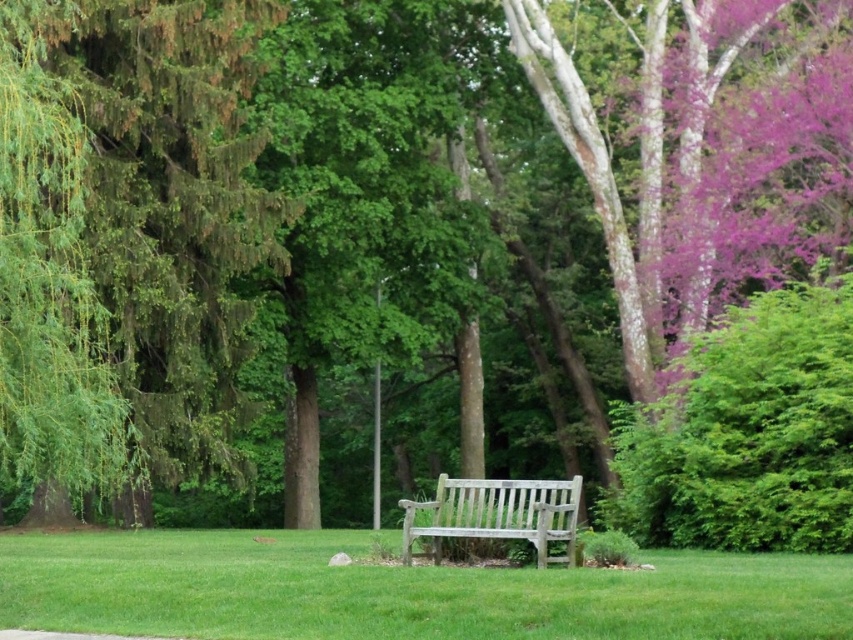
Question: Which point is closer to the camera taking this photo?

Choices:
 (A) (134, 273)
 (B) (207, 534)
 (C) (538, 536)

Answer: (C)

Question: Where is green grass at center located in relation to wooden bench at center in the image?

Choices:
 (A) left
 (B) right

Answer: (A)

Question: Among these points, which one is nearest to the camera?

Choices:
 (A) (445, 513)
 (B) (535, 600)

Answer: (B)

Question: Which is nearer to the green leafy tree at left?

Choices:
 (A) green grass at center
 (B) wooden bench at center

Answer: (A)

Question: Is green grass at center smaller than wooden bench at center?

Choices:
 (A) no
 (B) yes

Answer: (A)

Question: Where is green grass at center located in relation to wooden bench at center in the image?

Choices:
 (A) right
 (B) left

Answer: (B)